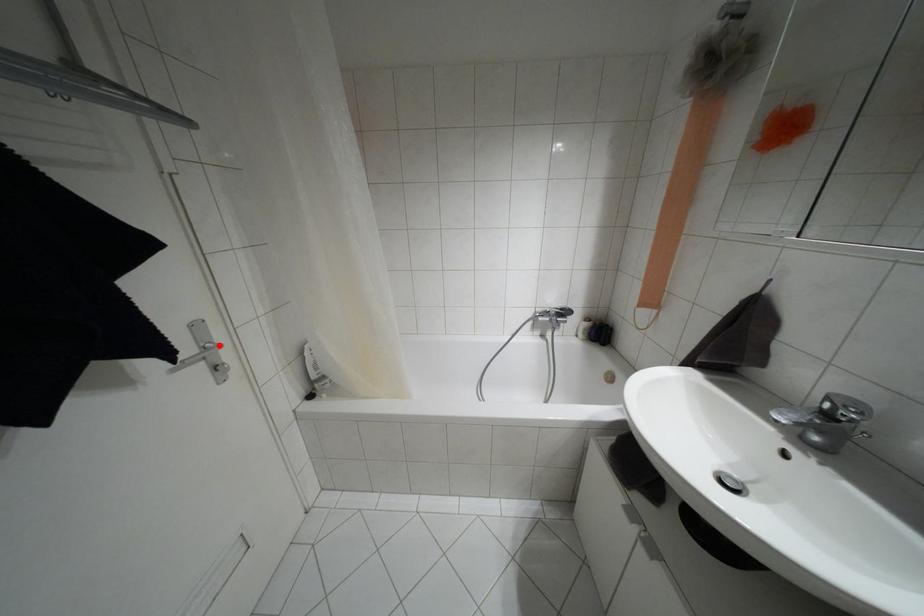
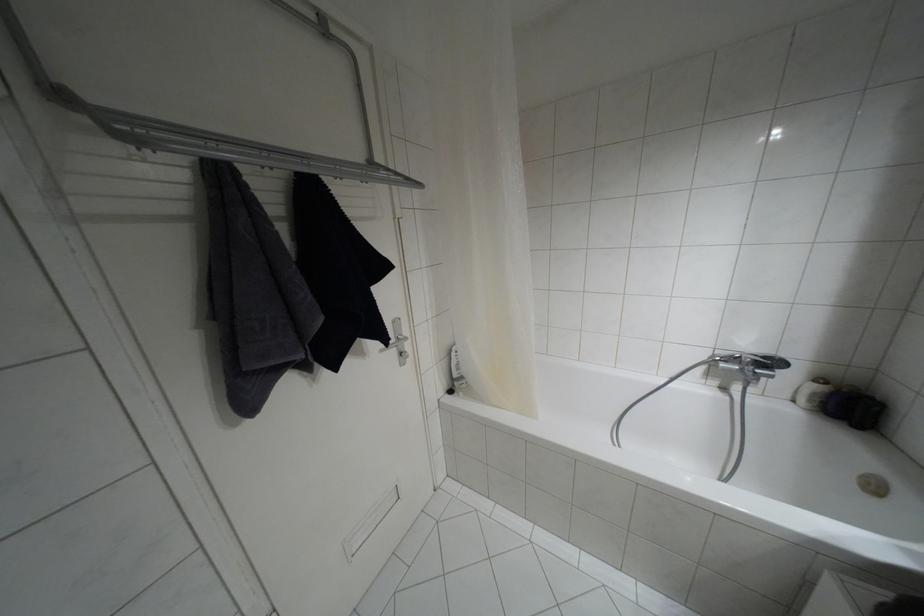
Where in the second image is the point corresponding to the highlighted location from the first image?

(406, 338)